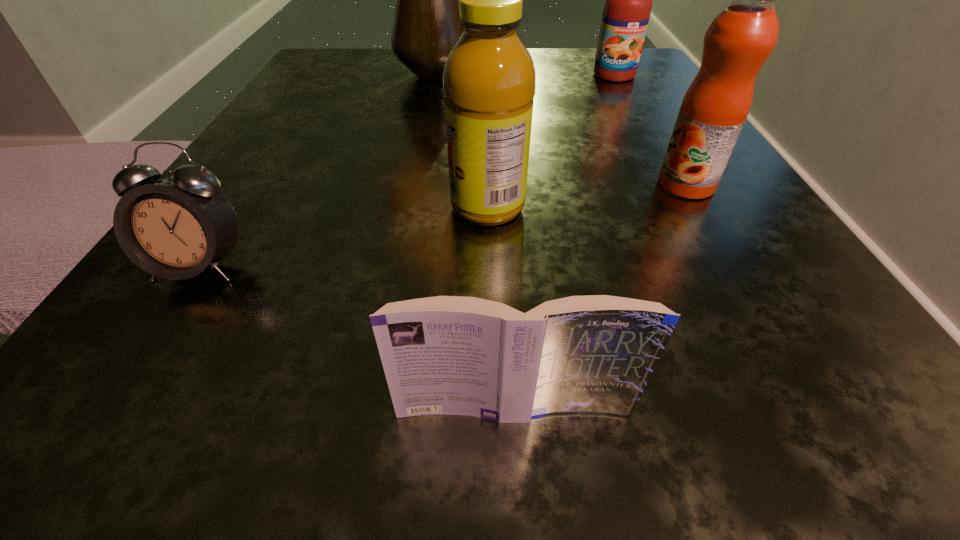
Identify the location of the tallest object. The width and height of the screenshot is (960, 540). (425, 28).

Find the location of a particular element. the farthest fruit juice is located at coordinates (627, 9).

Where is `the leftmost fruit juice`? the leftmost fruit juice is located at coordinates (489, 80).

This screenshot has height=540, width=960. I want to click on the leftmost object, so click(x=176, y=228).

The height and width of the screenshot is (540, 960). What are the coordinates of `alarm clock` in the screenshot? It's located at (176, 228).

You are a GUI agent. You are given a task and a screenshot of the screen. Output one action in this format:
    pyautogui.click(x=<x>, y=<y>)
    Task: Click on the book
    The height and width of the screenshot is (540, 960).
    Given the screenshot: What is the action you would take?
    pos(595,354)

This screenshot has width=960, height=540. Identify the location of vacant space located 0.400m on the front of the lampshade. (397, 282).

The width and height of the screenshot is (960, 540). I want to click on vacant space situated 0.090m on the front label of the farthest fruit juice, so click(x=631, y=105).

At what (x,y) coordinates should I click in order to perform the action: click on free spot located 0.250m on the front label of the leftmost fruit juice. Please return your answer as a coordinate pair (x, y). The height and width of the screenshot is (540, 960). Looking at the image, I should click on (234, 207).

Identify the location of vacant region located 0.190m on the front label of the leftmost fruit juice. This screenshot has height=540, width=960. (286, 207).